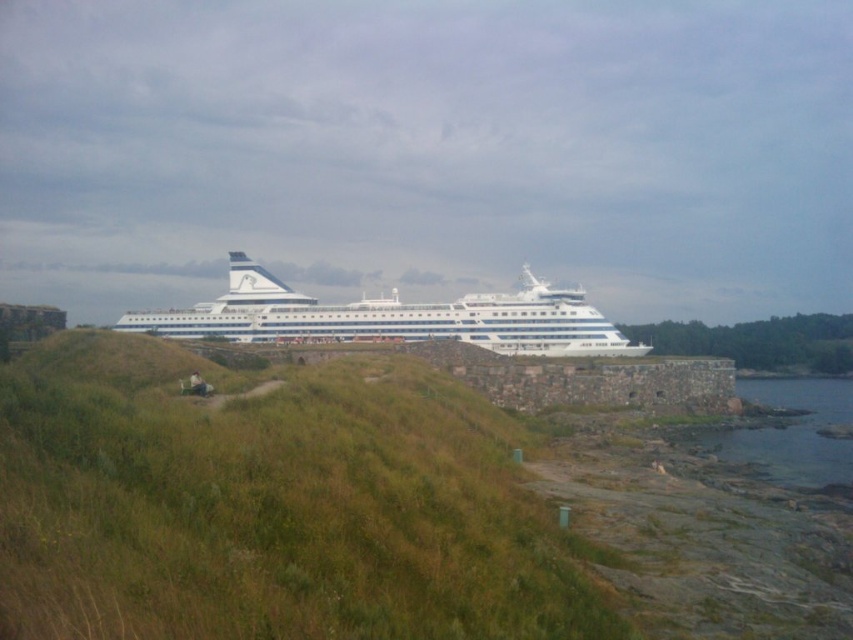
Can you confirm if green grassy at center is positioned to the left of clear water at lower right?

Correct, you'll find green grassy at center to the left of clear water at lower right.

Which is behind, point (564, 618) or point (795, 481)?

The point (795, 481) is behind.

Where is `green grassy at center`? green grassy at center is located at coordinates (270, 506).

Who is more distant from viewer, (260, 493) or (126, 326)?

The point (126, 326) is behind.

Can you confirm if green grassy at center is thinner than white glossy cruise ship at center?

Indeed, green grassy at center has a lesser width compared to white glossy cruise ship at center.

Between point (134, 630) and point (407, 305), which one is positioned in front?

Point (134, 630) is in front.

This screenshot has width=853, height=640. Find the location of `green grassy at center`. green grassy at center is located at coordinates (270, 506).

Does white glossy cruise ship at center have a lesser width compared to clear water at lower right?

No, white glossy cruise ship at center is not thinner than clear water at lower right.

What do you see at coordinates (393, 317) in the screenshot?
I see `white glossy cruise ship at center` at bounding box center [393, 317].

Identify the location of white glossy cruise ship at center. (393, 317).